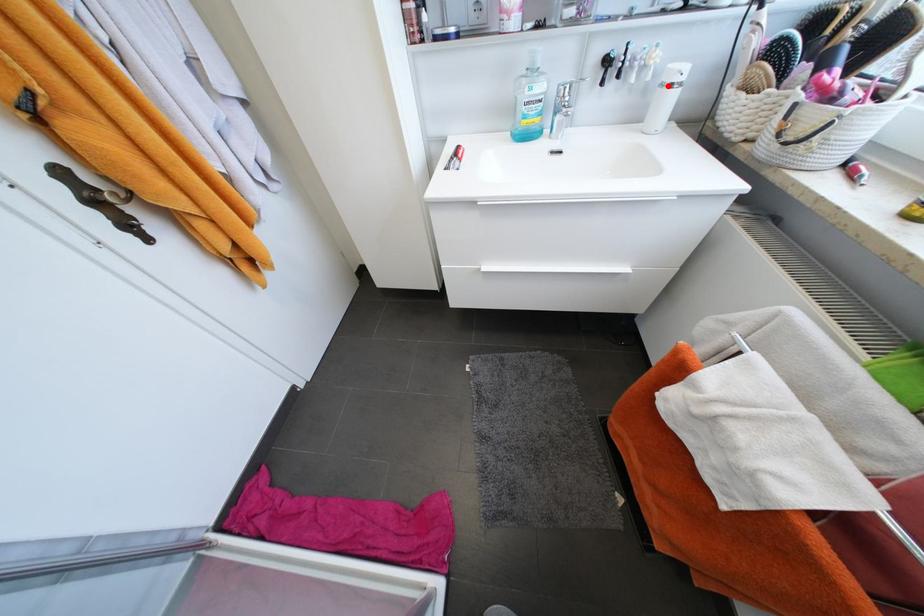
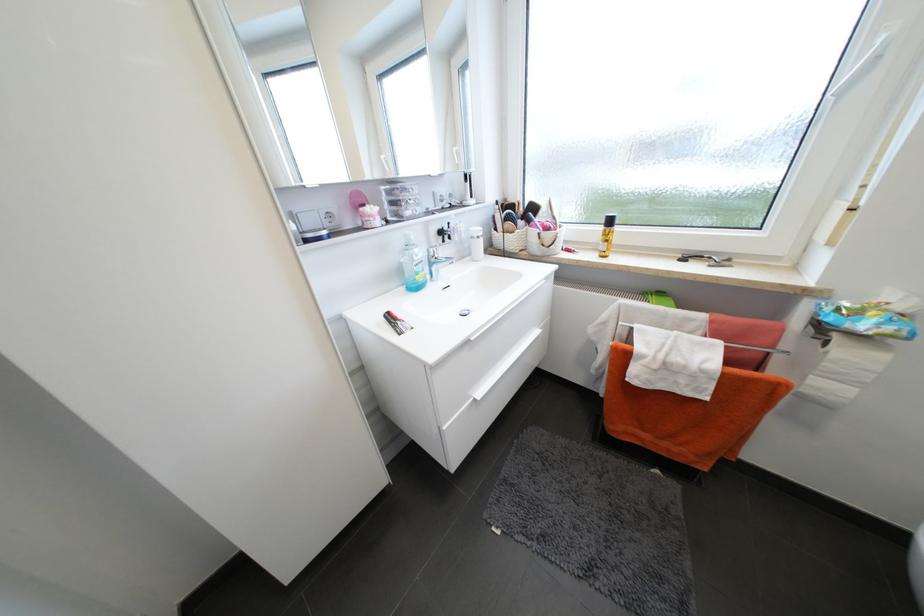
Question: I am providing you with two images of the same scene from different viewpoints. Given a red point in image1, look at the same physical point in image2. Is it:

Choices:
 (A) Closer to the viewpoint
 (B) Farther from the viewpoint

Answer: (A)